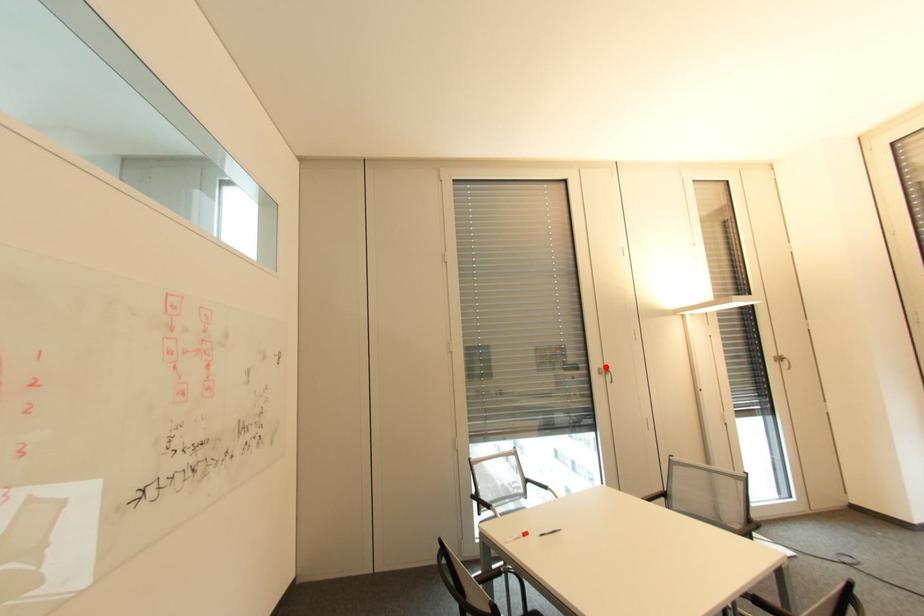
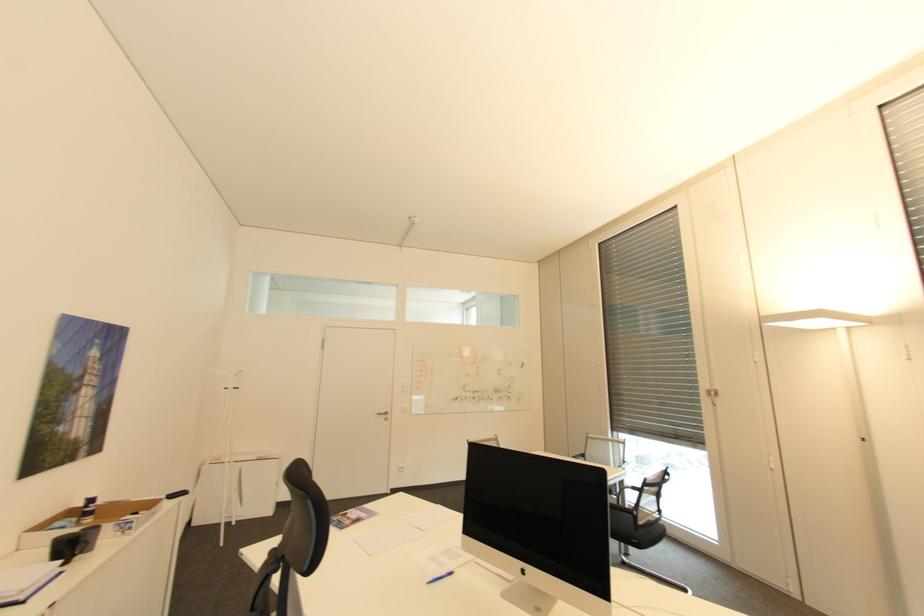
The point at the highlighted location is marked in the first image. Where is the corresponding point in the second image?

(713, 387)